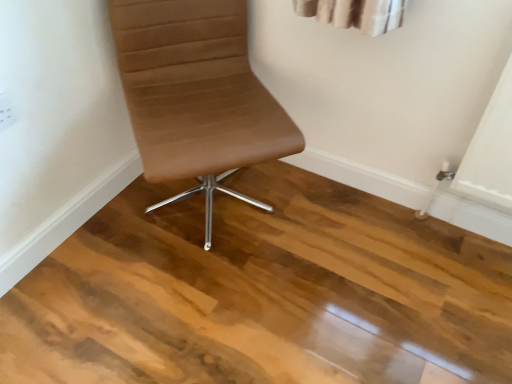
The height and width of the screenshot is (384, 512). Identify the location of vacant area to the right of brown leather chair at center. (333, 222).